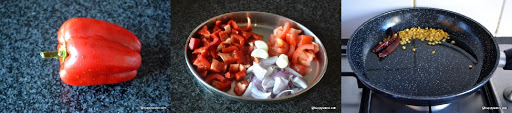
The height and width of the screenshot is (113, 512). In order to click on stove in this screenshot , I will do tap(465, 103).